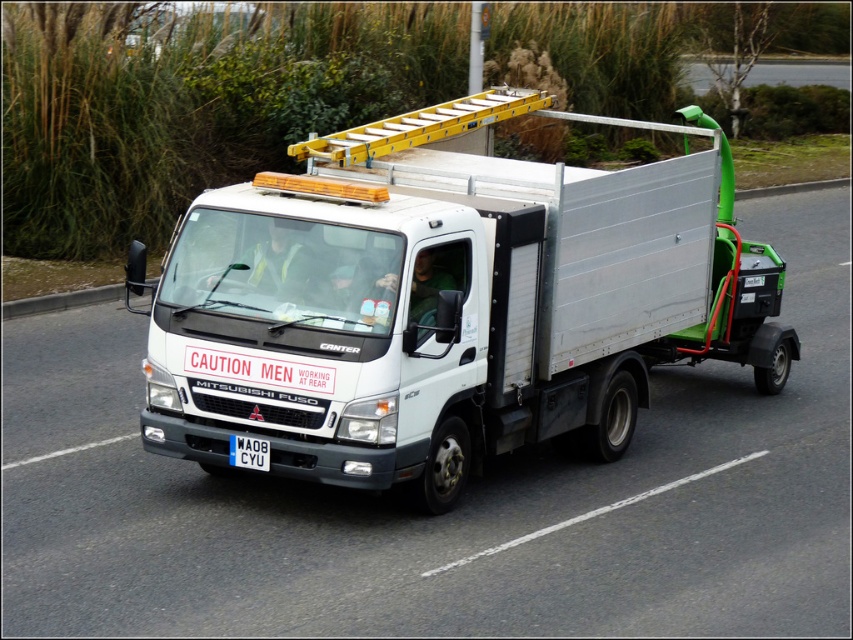
You are standing at the front of the white Mitsubishi Fuso Canter truck and want to locate two specific points marked on the truck. The first point is at coordinates point (467, 301) and the second is at point (265, 451). From your current position, which point is closer to you?

Point (265, 451) is closer to you because it is in front of point (467, 301).

You are a traffic officer observing the white metallic truck at center and the blue plastic license plate at center. According to traffic regulations, the distance between the truck and its license plate must be between 6 and 10 feet. Is the current distance compliant with the regulations?

The white metallic truck at center is 8.43 feet from the blue plastic license plate at center. Since 8.43 feet falls within the required 6 to 10 feet range, the distance is compliant with traffic regulations.

You are a pedestrian standing on the sidewalk. You see the white metallic truck at center and the blue plastic license plate at center. Which object is taller?

The white metallic truck at center is much taller than the blue plastic license plate at center.